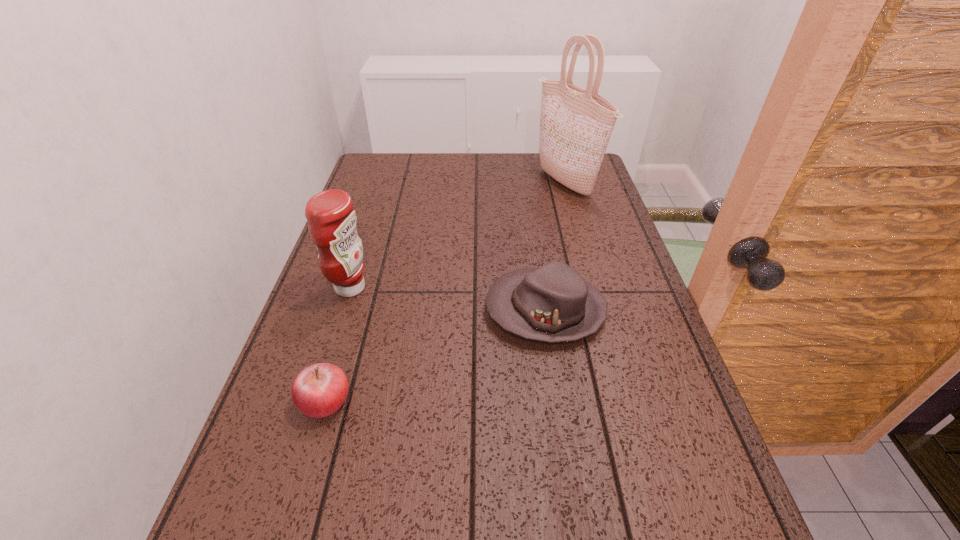
You are a GUI agent. You are given a task and a screenshot of the screen. Output one action in this format:
    pyautogui.click(x=<x>, y=<y>)
    Task: Click on the object that is the second closest to the shopping bag
    
    Given the screenshot: What is the action you would take?
    pyautogui.click(x=331, y=217)

Identify the location of object that ranks as the second closest to the hat. (331, 217).

What are the coordinates of `free space that satisfies the following two spatial constraints: 1. on the front side of the farthest object; 2. on the decorative side of the hat` in the screenshot? It's located at (602, 310).

I want to click on vacant space that satisfies the following two spatial constraints: 1. on the decorative side of the hat; 2. on the front side of the nearest object, so coord(559,401).